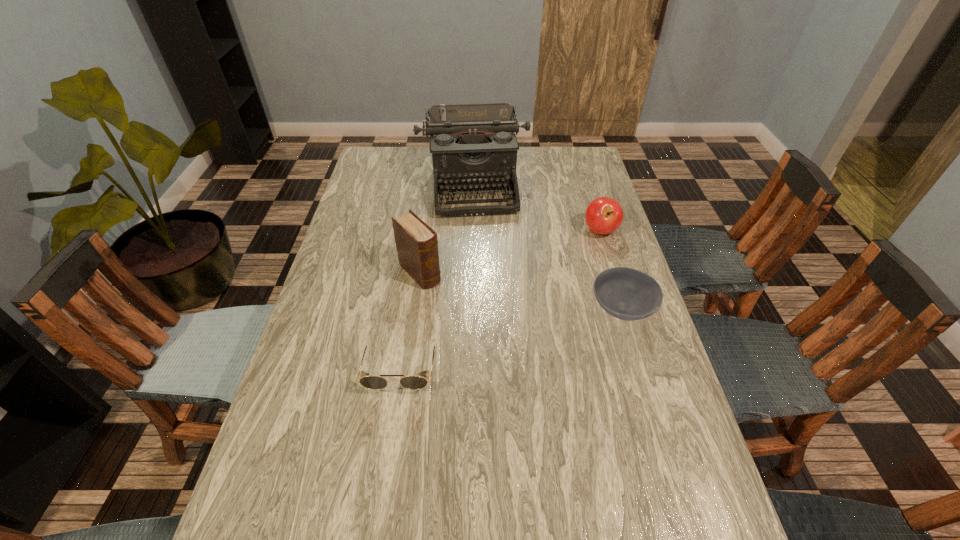
Image resolution: width=960 pixels, height=540 pixels. What are the coordinates of `free spot on the desktop that is between the nearest object and the bowl and is positioned on the spine side of the diary` in the screenshot? It's located at (491, 345).

The width and height of the screenshot is (960, 540). I want to click on vacant spot on the desktop that is between the sunglasses and the bowl and is positioned on the typing side of the tallest object, so click(491, 345).

I want to click on free spot on the desktop that is between the nearest object and the bowl and is positioned on the stem of the apple, so click(484, 346).